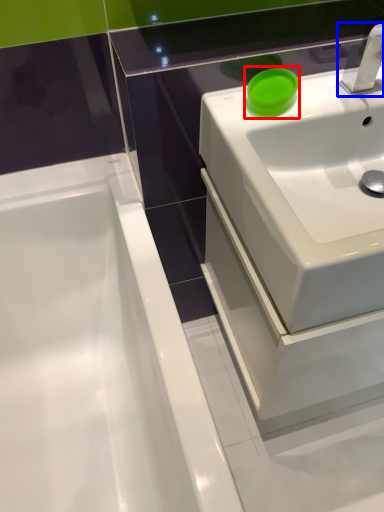
Question: Which object is further to the camera taking this photo, teal (highlighted by a red box) or tap (highlighted by a blue box)?

Choices:
 (A) teal
 (B) tap

Answer: (A)